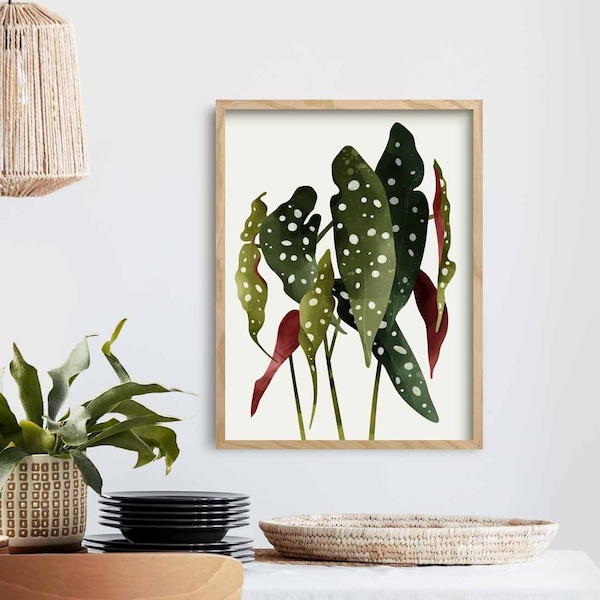
Identify the location of plates. The width and height of the screenshot is (600, 600). (186, 514).